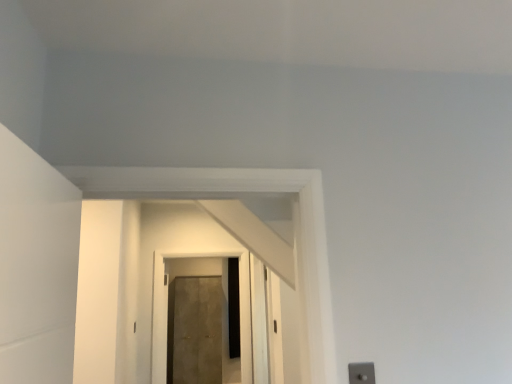
I want to click on matte brown door at center, marked as the second door in a back-to-front arrangement, so click(x=167, y=310).

The image size is (512, 384). Describe the element at coordinates (167, 310) in the screenshot. I see `matte brown door at center, marked as the second door in a back-to-front arrangement` at that location.

Locate an element on the screen. The height and width of the screenshot is (384, 512). matte concrete door at center, placed as the second door when sorted from front to back is located at coordinates (195, 330).

Identify the location of silver metallic switch at lower right. (361, 373).

At what (x,y) coordinates should I click in order to perform the action: click on matte brown door at center, marked as the second door in a back-to-front arrangement. Please return your answer as a coordinate pair (x, y). This screenshot has width=512, height=384. Looking at the image, I should click on [167, 310].

Is point (244, 255) farther from camera compared to point (351, 364)?

Yes, it is behind point (351, 364).

From the image's perspective, between matte brown door at center, marked as the second door in a back-to-front arrangement, and silver metallic switch at lower right, who is located below?

matte brown door at center, marked as the second door in a back-to-front arrangement, is shown below in the image.

Which object is further away from the camera, matte brown door at center, which appears as the first door when viewed from the front, or silver metallic switch at lower right?

matte brown door at center, which appears as the first door when viewed from the front, is further away from the camera.

Considering the sizes of objects matte concrete door at center, placed as the second door when sorted from front to back, and matte brown door at center, marked as the second door in a back-to-front arrangement, in the image provided, who is smaller, matte concrete door at center, placed as the second door when sorted from front to back, or matte brown door at center, marked as the second door in a back-to-front arrangement,?

Smaller between the two is matte brown door at center, marked as the second door in a back-to-front arrangement.

Is matte concrete door at center, the 1th door from the back, behind matte brown door at center, marked as the second door in a back-to-front arrangement?

Yes, it is.

Is matte concrete door at center, the 1th door from the back, positioned beyond the bounds of matte brown door at center, which appears as the first door when viewed from the front?

Yes, matte concrete door at center, the 1th door from the back, is not within matte brown door at center, which appears as the first door when viewed from the front.

From the image's perspective, is matte concrete door at center, the 1th door from the back, positioned above or below matte brown door at center, which appears as the first door when viewed from the front?

matte concrete door at center, the 1th door from the back, is situated lower than matte brown door at center, which appears as the first door when viewed from the front, in the image.

Is silver metallic switch at lower right far away from matte concrete door at center, the 1th door from the back?

Yes, silver metallic switch at lower right and matte concrete door at center, the 1th door from the back, are quite far apart.

Who is more distant, silver metallic switch at lower right or matte concrete door at center, the 1th door from the back?

matte concrete door at center, the 1th door from the back, is behind.

Considering the relative sizes of silver metallic switch at lower right and matte concrete door at center, the 1th door from the back, in the image provided, is silver metallic switch at lower right bigger than matte concrete door at center, the 1th door from the back,?

No, silver metallic switch at lower right is not bigger than matte concrete door at center, the 1th door from the back.

Considering the positions of objects silver metallic switch at lower right and matte brown door at center, which appears as the first door when viewed from the front, in the image provided, who is in front, silver metallic switch at lower right or matte brown door at center, which appears as the first door when viewed from the front,?

Positioned in front is silver metallic switch at lower right.

From a real-world perspective, is silver metallic switch at lower right above or below matte brown door at center, marked as the second door in a back-to-front arrangement?

silver metallic switch at lower right is below matte brown door at center, marked as the second door in a back-to-front arrangement.

Does point (352, 368) appear closer or farther from the camera than point (224, 250)?

Clearly, point (352, 368) is closer to the camera than point (224, 250).

From a real-world perspective, which is physically below, matte concrete door at center, placed as the second door when sorted from front to back, or silver metallic switch at lower right?

From a 3D spatial view, matte concrete door at center, placed as the second door when sorted from front to back, is below.

Is matte concrete door at center, placed as the second door when sorted from front to back, facing away from silver metallic switch at lower right?

No, matte concrete door at center, placed as the second door when sorted from front to back, is not facing the opposite direction of silver metallic switch at lower right.

Is matte concrete door at center, the 1th door from the back, wider or thinner than silver metallic switch at lower right?

Clearly, matte concrete door at center, the 1th door from the back, has more width compared to silver metallic switch at lower right.

Is matte concrete door at center, placed as the second door when sorted from front to back, inside matte brown door at center, which appears as the first door when viewed from the front?

Actually, matte concrete door at center, placed as the second door when sorted from front to back, is outside matte brown door at center, which appears as the first door when viewed from the front.

Is matte brown door at center, marked as the second door in a back-to-front arrangement, shorter than matte concrete door at center, the 1th door from the back?

Yes, matte brown door at center, marked as the second door in a back-to-front arrangement, is shorter than matte concrete door at center, the 1th door from the back.

Is matte brown door at center, which appears as the first door when viewed from the front, turned away from matte concrete door at center, placed as the second door when sorted from front to back?

Yes.

Find the location of a particular element. The image size is (512, 384). electric outlet located underneath the matte brown door at center, marked as the second door in a back-to-front arrangement (from a real-world perspective) is located at coordinates (x=361, y=373).

Locate an element on the screen. door above the matte concrete door at center, placed as the second door when sorted from front to back (from a real-world perspective) is located at coordinates (167, 310).

Estimate the real-world distances between objects in this image. Which object is closer to silver metallic switch at lower right, matte concrete door at center, placed as the second door when sorted from front to back, or matte brown door at center, which appears as the first door when viewed from the front?

matte brown door at center, which appears as the first door when viewed from the front, is positioned closer to the anchor silver metallic switch at lower right.

In the scene shown: Looking at the image, which one is located further to silver metallic switch at lower right, matte brown door at center, which appears as the first door when viewed from the front, or matte concrete door at center, placed as the second door when sorted from front to back?

matte concrete door at center, placed as the second door when sorted from front to back.

From the image, which object appears to be farther from matte concrete door at center, the 1th door from the back, matte brown door at center, which appears as the first door when viewed from the front, or silver metallic switch at lower right?

Based on the image, silver metallic switch at lower right appears to be further to matte concrete door at center, the 1th door from the back.

Which object lies further to the anchor point matte brown door at center, which appears as the first door when viewed from the front, matte concrete door at center, the 1th door from the back, or silver metallic switch at lower right?

silver metallic switch at lower right is further to matte brown door at center, which appears as the first door when viewed from the front.

From the image, which object appears to be nearer to matte brown door at center, which appears as the first door when viewed from the front, silver metallic switch at lower right or matte concrete door at center, the 1th door from the back?

Among the two, matte concrete door at center, the 1th door from the back, is located nearer to matte brown door at center, which appears as the first door when viewed from the front.

From the image, which object appears to be nearer to matte concrete door at center, placed as the second door when sorted from front to back, silver metallic switch at lower right or matte brown door at center, which appears as the first door when viewed from the front?

matte brown door at center, which appears as the first door when viewed from the front.

The width and height of the screenshot is (512, 384). Find the location of `door located between silver metallic switch at lower right and matte concrete door at center, placed as the second door when sorted from front to back, in the depth direction`. door located between silver metallic switch at lower right and matte concrete door at center, placed as the second door when sorted from front to back, in the depth direction is located at coordinates (167, 310).